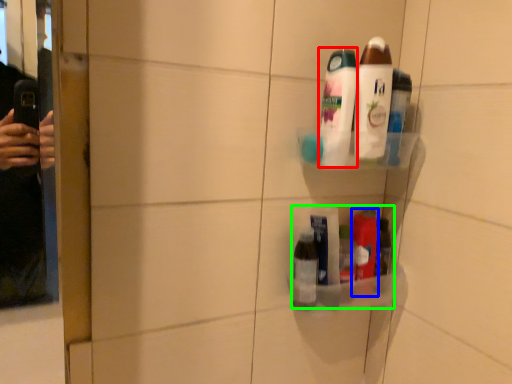
Question: Which object is the closest to the toiletry (highlighted by a red box)? Choose among these: toiletry (highlighted by a blue box) or product (highlighted by a green box).

Choices:
 (A) toiletry
 (B) product

Answer: (B)